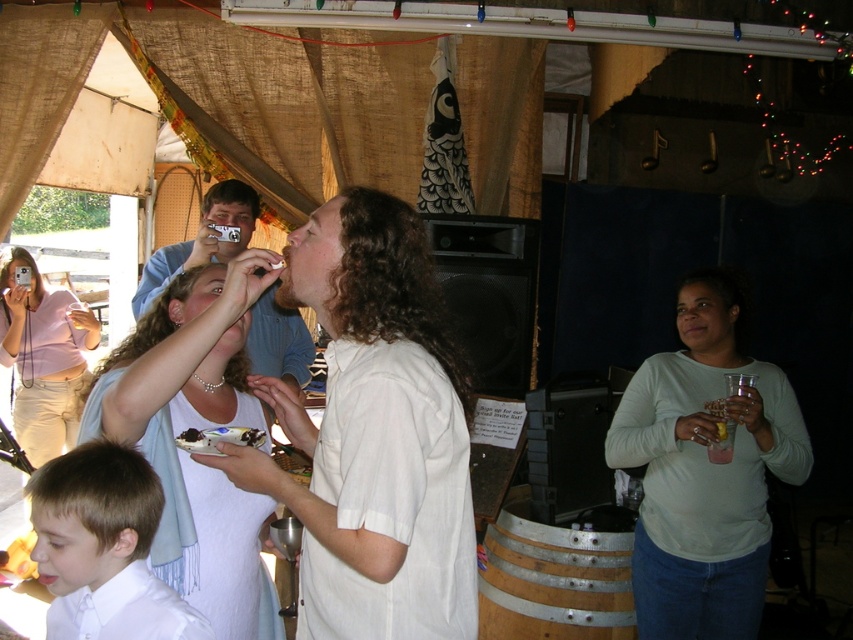
You are at a festival and see the white fabric scarf at upper left and the white smooth shirt at lower left. Which one is taller?

The white fabric scarf at upper left is taller than the white smooth shirt at lower left.